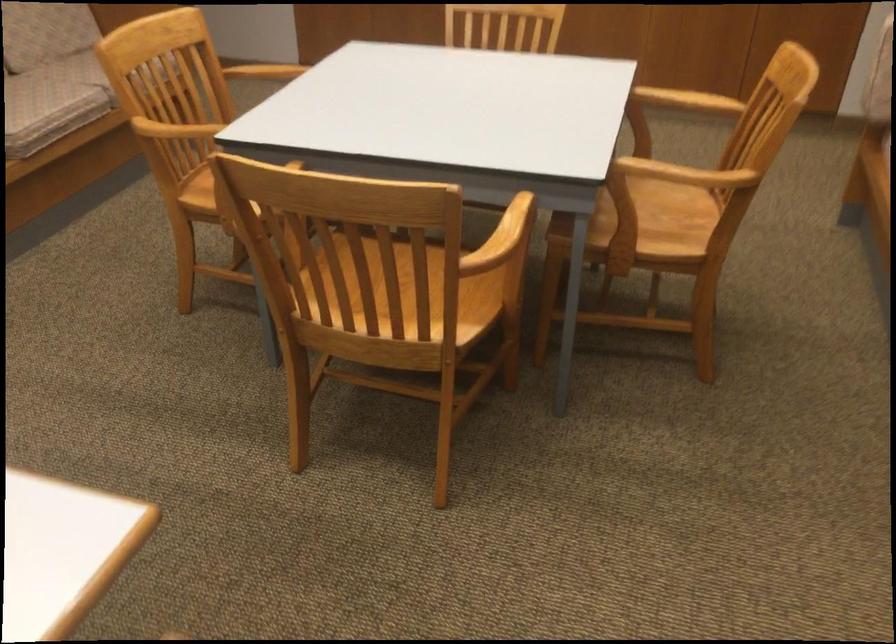
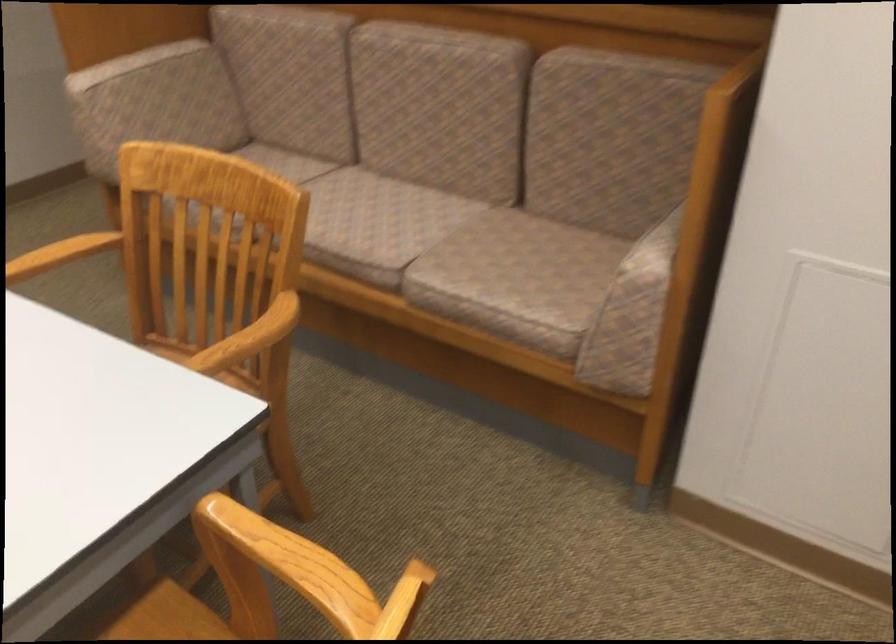
In the second image, find the point that corresponds to pixel 684 169 in the first image.

(248, 339)